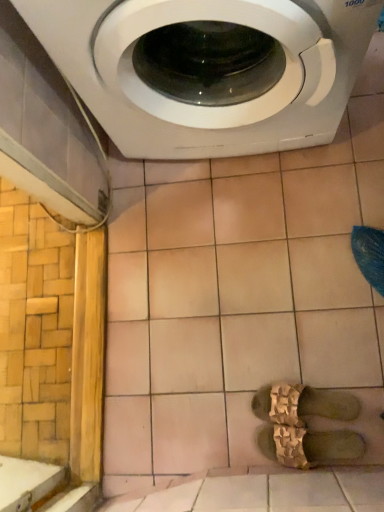
Question: Is gold textured sandals at center, the first shoe when ordered from top to bottom, shorter than brown textured sandals at center, which is the 2th shoe in top-to-bottom order?

Choices:
 (A) yes
 (B) no

Answer: (A)

Question: From a real-world perspective, is gold textured sandals at center, the first shoe when ordered from top to bottom, located beneath brown textured sandals at center, which is the 2th shoe in top-to-bottom order?

Choices:
 (A) no
 (B) yes

Answer: (B)

Question: From the image's perspective, would you say gold textured sandals at center, the first shoe when ordered from top to bottom, is shown under brown textured sandals at center, acting as the first shoe starting from the bottom?

Choices:
 (A) no
 (B) yes

Answer: (A)

Question: From a real-world perspective, is gold textured sandals at center, which appears as the 2th shoe when ordered from the bottom, located higher than brown textured sandals at center, acting as the first shoe starting from the bottom?

Choices:
 (A) yes
 (B) no

Answer: (B)

Question: Are gold textured sandals at center, which appears as the 2th shoe when ordered from the bottom, and brown textured sandals at center, acting as the first shoe starting from the bottom, beside each other?

Choices:
 (A) yes
 (B) no

Answer: (A)

Question: In the image, is brown textured sandals at center, acting as the first shoe starting from the bottom, positioned in front of or behind gold textured sandals at center, the first shoe when ordered from top to bottom?

Choices:
 (A) behind
 (B) front

Answer: (B)

Question: Considering the positions of brown textured sandals at center, which is the 2th shoe in top-to-bottom order, and gold textured sandals at center, the first shoe when ordered from top to bottom, in the image, is brown textured sandals at center, which is the 2th shoe in top-to-bottom order, taller or shorter than gold textured sandals at center, the first shoe when ordered from top to bottom,?

Choices:
 (A) tall
 (B) short

Answer: (A)

Question: Based on their positions, is brown textured sandals at center, which is the 2th shoe in top-to-bottom order, located to the left or right of gold textured sandals at center, the first shoe when ordered from top to bottom?

Choices:
 (A) left
 (B) right

Answer: (A)

Question: From a real-world perspective, is brown textured sandals at center, acting as the first shoe starting from the bottom, physically located above or below gold textured sandals at center, which appears as the 2th shoe when ordered from the bottom?

Choices:
 (A) above
 (B) below

Answer: (A)

Question: In terms of height, does white glossy washing machine at upper center look taller or shorter compared to brown textured sandals at center, which is the 2th shoe in top-to-bottom order?

Choices:
 (A) tall
 (B) short

Answer: (A)

Question: From a real-world perspective, is white glossy washing machine at upper center positioned above or below brown textured sandals at center, which is the 2th shoe in top-to-bottom order?

Choices:
 (A) above
 (B) below

Answer: (A)

Question: Is white glossy washing machine at upper center wider or thinner than brown textured sandals at center, which is the 2th shoe in top-to-bottom order?

Choices:
 (A) wide
 (B) thin

Answer: (A)

Question: Would you say white glossy washing machine at upper center is to the left or to the right of brown textured sandals at center, acting as the first shoe starting from the bottom, in the picture?

Choices:
 (A) right
 (B) left

Answer: (B)

Question: Is beige ceramic tile at upper center wider or thinner than gold textured sandals at center, which appears as the 2th shoe when ordered from the bottom?

Choices:
 (A) thin
 (B) wide

Answer: (B)

Question: From their relative heights in the image, would you say beige ceramic tile at upper center is taller or shorter than gold textured sandals at center, which appears as the 2th shoe when ordered from the bottom?

Choices:
 (A) tall
 (B) short

Answer: (B)